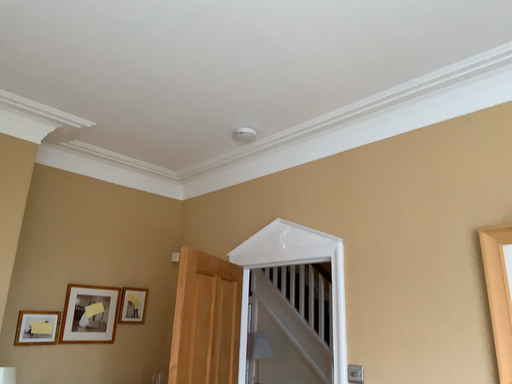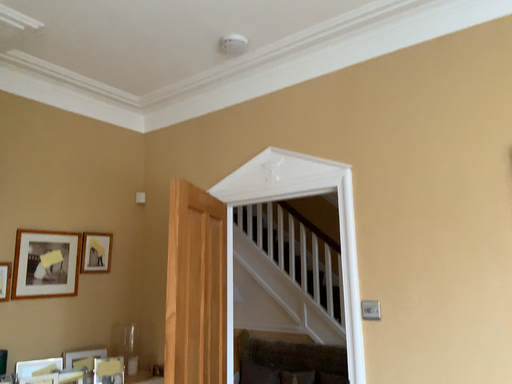
Question: How did the camera likely rotate when shooting the video?

Choices:
 (A) rotated upward
 (B) rotated downward

Answer: (B)